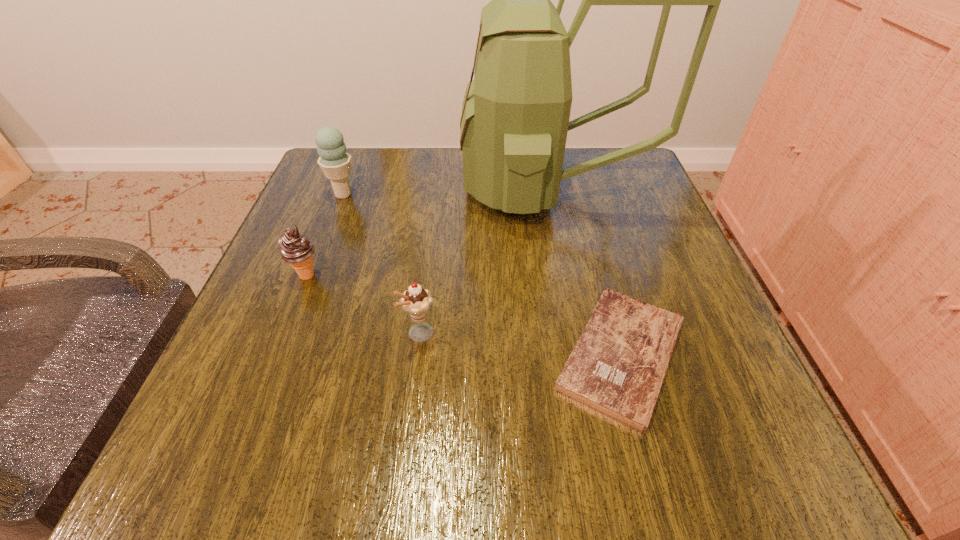
Find the location of `object situated at the far right corner`. object situated at the far right corner is located at coordinates (515, 116).

Find the location of `object that is at the near right corner`. object that is at the near right corner is located at coordinates (617, 367).

This screenshot has width=960, height=540. I want to click on vacant space at the far edge of the desktop, so click(449, 156).

In the image, there is a desktop. In order to click on free region at the near edge in this screenshot , I will do `click(434, 472)`.

This screenshot has height=540, width=960. What are the coordinates of `free location at the left edge` in the screenshot? It's located at (325, 372).

Locate an element on the screen. The height and width of the screenshot is (540, 960). blank space at the right edge of the desktop is located at coordinates (636, 292).

What are the coordinates of `vacant area at the near left corner of the desktop` in the screenshot? It's located at (302, 432).

Identify the location of free space at the far right corner. [x=622, y=200].

You are a GUI agent. You are given a task and a screenshot of the screen. Output one action in this format:
    pyautogui.click(x=<x>, y=<y>)
    Task: Click on the unoccupied position between the third farthest object and the tallest object
    Image resolution: width=960 pixels, height=540 pixels.
    Given the screenshot: What is the action you would take?
    pyautogui.click(x=428, y=233)

The height and width of the screenshot is (540, 960). I want to click on free space that is in between the third object from left to right and the backpack, so click(x=486, y=262).